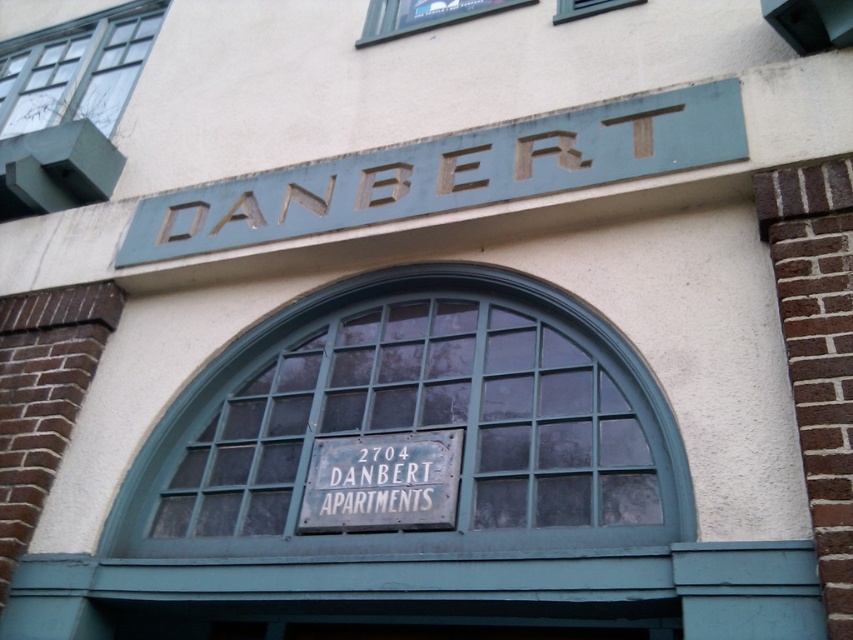
You are standing at the entrance of DANBERT and want to hang a new rectangular sign that is 1.2 meters tall. The existing signs are the green painted metal sign at upper center and the white metal sign at center. Which existing sign should you use as a reference for the height of your new sign?

The green painted metal sign at upper center is much taller than the white metal sign at center. Since your new sign is 1.2 meters tall, you should compare it with the green painted metal sign at upper center to ensure proper height alignment.

You are standing in front of the DANBERT building and want to locate the apartment number. Which sign should you look at first, the green painted metal sign at upper center or the white metal sign at center?

The green painted metal sign at upper center is above the white metal sign at center, so you should look at the white metal sign at center first since it is lower and closer to eye level.